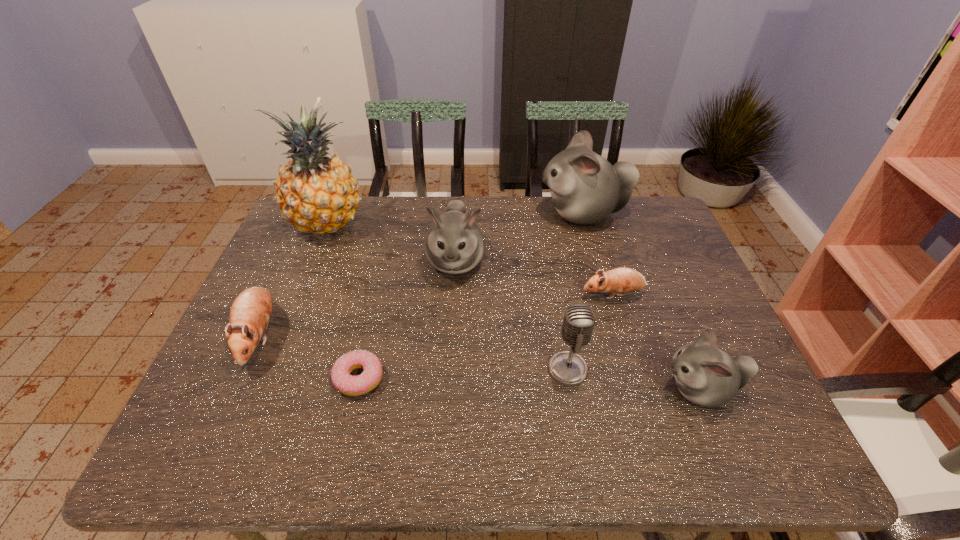
Where is `hamster that is the fourth closest to the third tallest hamster`? The width and height of the screenshot is (960, 540). hamster that is the fourth closest to the third tallest hamster is located at coordinates (250, 313).

The height and width of the screenshot is (540, 960). Identify the location of the second closest white hamster to the shortest object. (706, 375).

I want to click on white hamster identified as the second closest to the second smallest white hamster, so click(x=706, y=375).

The width and height of the screenshot is (960, 540). Find the location of `free space that satisfies the following two spatial constraints: 1. on the front side of the pineapple; 2. on the right side of the third object from left to right`. free space that satisfies the following two spatial constraints: 1. on the front side of the pineapple; 2. on the right side of the third object from left to right is located at coordinates (264, 378).

Locate an element on the screen. This screenshot has width=960, height=540. free space that satisfies the following two spatial constraints: 1. on the face of the second nearest white hamster; 2. on the left side of the gray microphone is located at coordinates (449, 369).